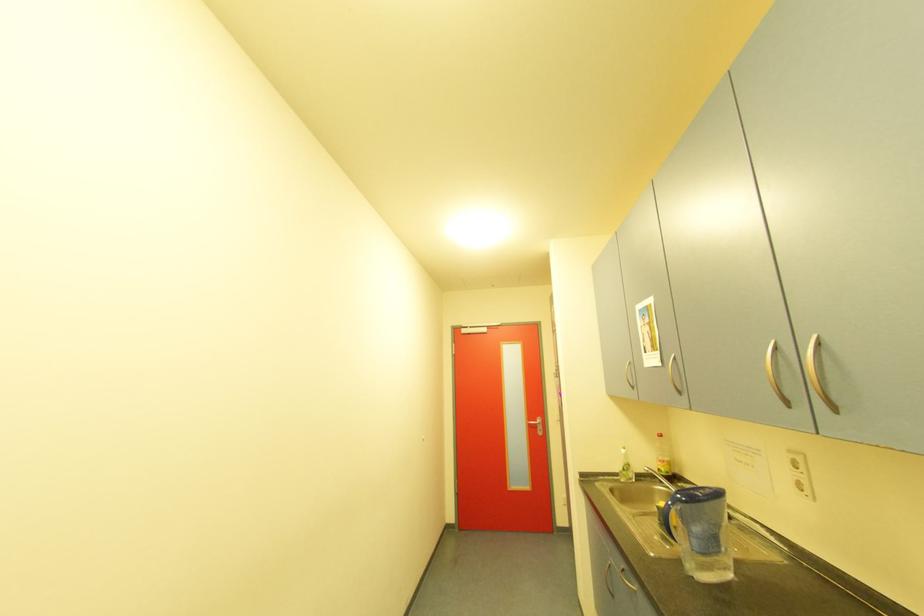
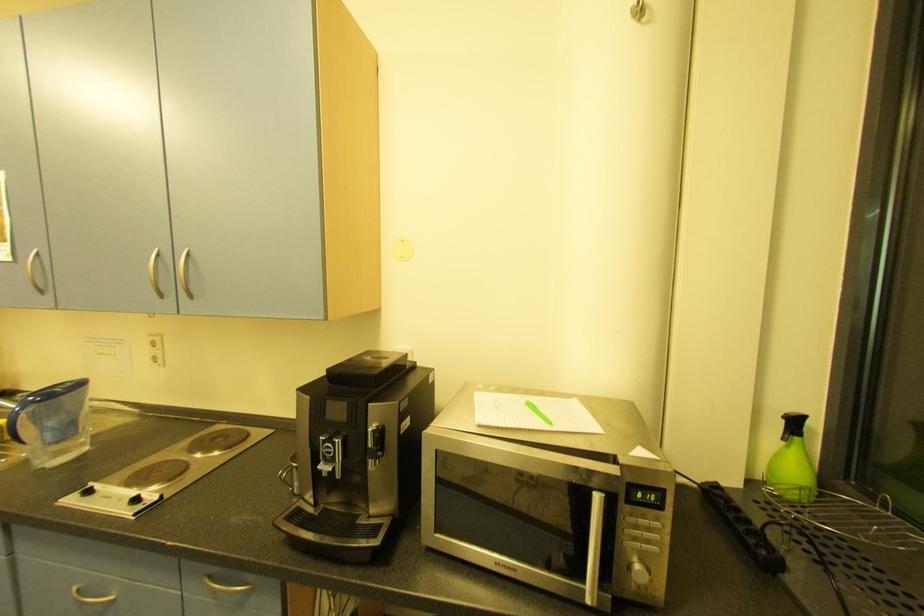
Question: The camera is either moving clockwise (left) or counter-clockwise (right) around the object. The first image is from the beginning of the video and the second image is from the end. Is the camera moving left or right when shooting the video?

Choices:
 (A) Left
 (B) Right

Answer: (A)